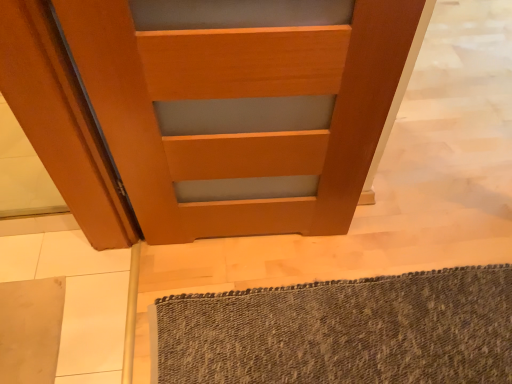
Find the location of a particular element. free location to the right of wooden door at center is located at coordinates (351, 248).